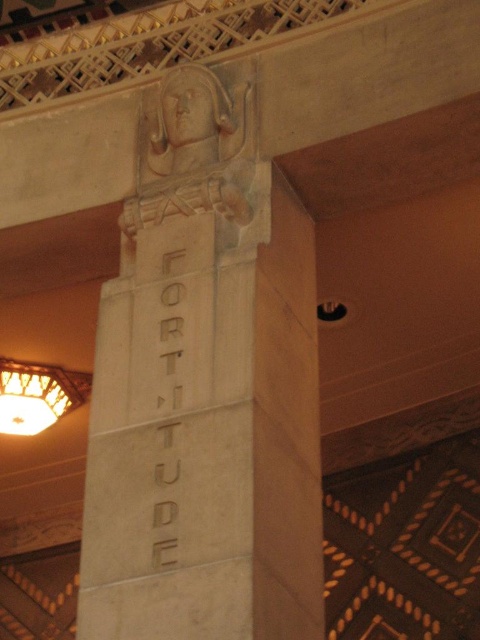
Question: Is white stone relief at center below matte brass lampshade at left?

Choices:
 (A) no
 (B) yes

Answer: (A)

Question: Which point is farther to the camera?

Choices:
 (A) white stone relief at center
 (B) matte brass lampshade at left

Answer: (B)

Question: Which point is closer to the camera?

Choices:
 (A) matte brass lampshade at left
 (B) white stone relief at center

Answer: (B)

Question: Does white stone relief at center have a lesser width compared to matte brass lampshade at left?

Choices:
 (A) yes
 (B) no

Answer: (A)

Question: Which object is farther from the camera taking this photo?

Choices:
 (A) white stone relief at center
 (B) matte brass lampshade at left

Answer: (B)

Question: Does white stone relief at center come in front of matte brass lampshade at left?

Choices:
 (A) no
 (B) yes

Answer: (B)